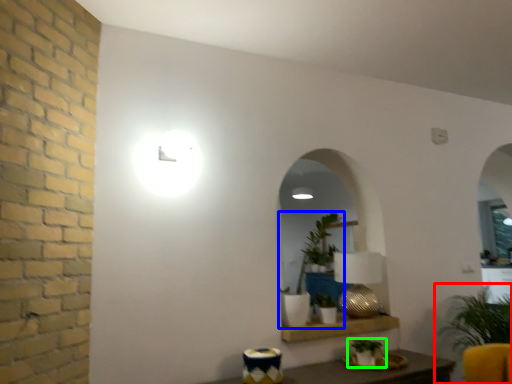
Question: Which is nearer to the houseplant (highlighted by a red box)? houseplant (highlighted by a blue box) or houseplant (highlighted by a green box).

Choices:
 (A) houseplant
 (B) houseplant

Answer: (B)